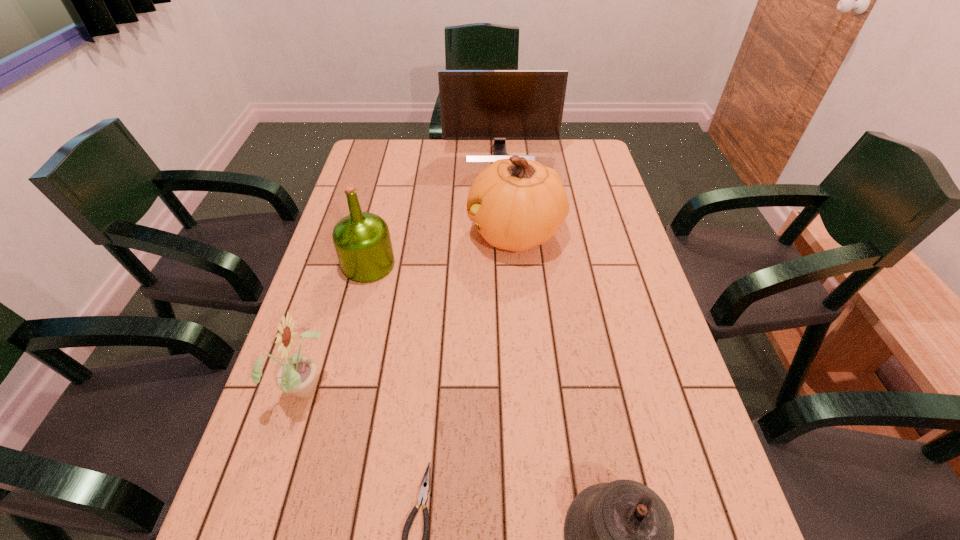
Image resolution: width=960 pixels, height=540 pixels. In order to click on object that is the second closest to the pumpkin in this screenshot , I will do `click(499, 105)`.